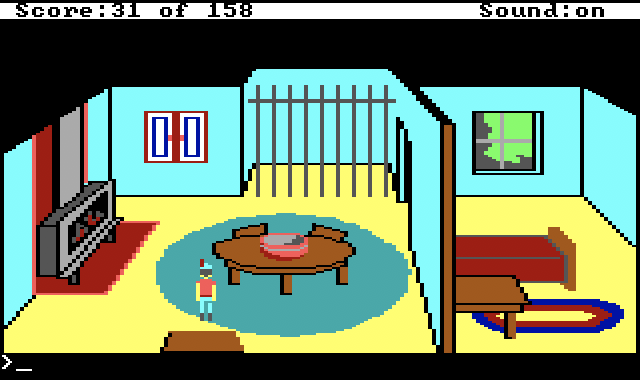
You are a GUI agent. You are given a task and a screenshot of the screen. Output one action in this format:
    pyautogui.click(x=<x>, y=<y>)
    Task: Click on the table next to bed
    This screenshot has width=640, height=380.
    Given the screenshot: What is the action you would take?
    pyautogui.click(x=493, y=290)